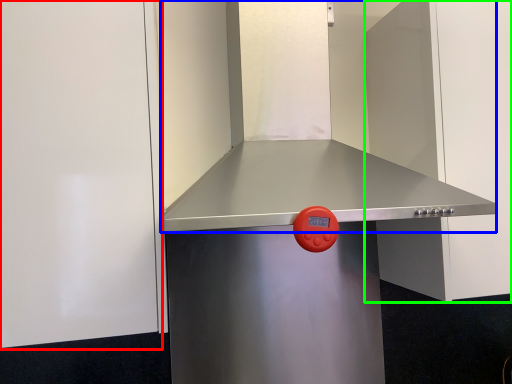
Question: Considering the real-world distances, which object is farthest from door (highlighted by a red box)? vent (highlighted by a blue box) or door (highlighted by a green box)?

Choices:
 (A) vent
 (B) door

Answer: (B)